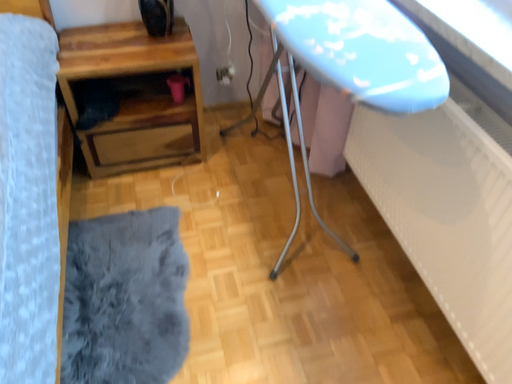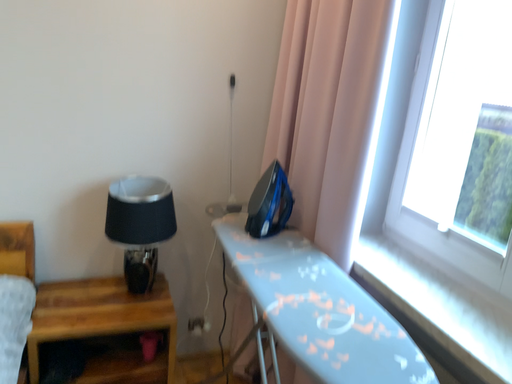
Question: How did the camera likely rotate when shooting the video?

Choices:
 (A) rotated left
 (B) rotated right

Answer: (B)